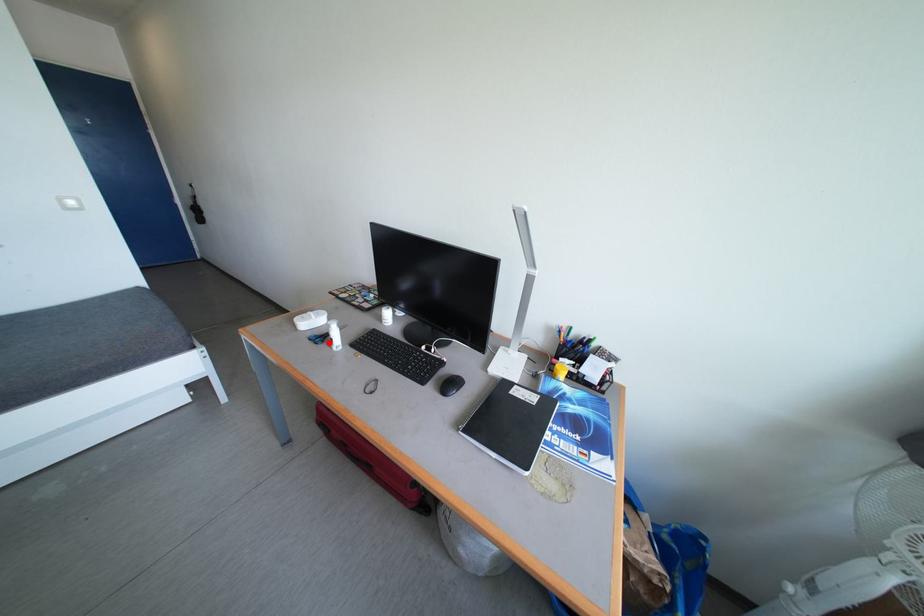
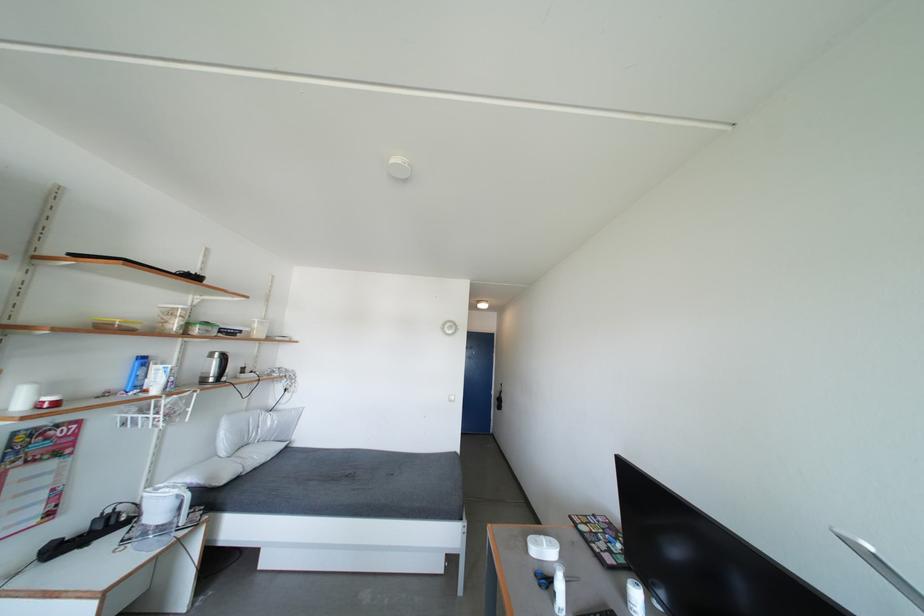
Locate, in the second image, the point that corresponds to the highlighted location in the first image.

(553, 588)